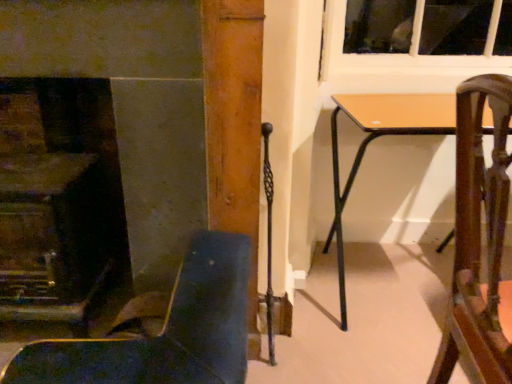
Question: Can you confirm if wooden chair at right, the second chair viewed from the left, is smaller than smooth stone fireplace at left?

Choices:
 (A) no
 (B) yes

Answer: (A)

Question: Is wooden chair at right, placed as the first chair when sorted from right to left, behind smooth stone fireplace at left?

Choices:
 (A) no
 (B) yes

Answer: (A)

Question: Would you say wooden chair at right, the second chair viewed from the left, is outside smooth stone fireplace at left?

Choices:
 (A) no
 (B) yes

Answer: (B)

Question: Is wooden chair at right, the second chair viewed from the left, wider than smooth stone fireplace at left?

Choices:
 (A) no
 (B) yes

Answer: (B)

Question: From a real-world perspective, is wooden chair at right, placed as the first chair when sorted from right to left, on top of smooth stone fireplace at left?

Choices:
 (A) no
 (B) yes

Answer: (A)

Question: Based on their sizes in the image, would you say smooth stone fireplace at left is bigger or smaller than light brown wooden table at center?

Choices:
 (A) small
 (B) big

Answer: (A)

Question: Does point (24, 236) appear closer or farther from the camera than point (430, 112)?

Choices:
 (A) closer
 (B) farther

Answer: (A)

Question: Looking at their shapes, would you say smooth stone fireplace at left is wider or thinner than light brown wooden table at center?

Choices:
 (A) wide
 (B) thin

Answer: (B)

Question: Is smooth stone fireplace at left in front of or behind light brown wooden table at center in the image?

Choices:
 (A) behind
 (B) front

Answer: (B)

Question: From the image's perspective, is leather-like dark blue chair at lower left, placed as the second chair when sorted from right to left, positioned above or below wooden chair at right, placed as the first chair when sorted from right to left?

Choices:
 (A) below
 (B) above

Answer: (A)

Question: In terms of size, does leather-like dark blue chair at lower left, marked as the 1th chair in a left-to-right arrangement, appear bigger or smaller than wooden chair at right, placed as the first chair when sorted from right to left?

Choices:
 (A) big
 (B) small

Answer: (A)

Question: Visually, is leather-like dark blue chair at lower left, placed as the second chair when sorted from right to left, positioned to the left or to the right of wooden chair at right, placed as the first chair when sorted from right to left?

Choices:
 (A) right
 (B) left

Answer: (B)

Question: Considering the positions of leather-like dark blue chair at lower left, placed as the second chair when sorted from right to left, and wooden chair at right, the second chair viewed from the left, in the image, is leather-like dark blue chair at lower left, placed as the second chair when sorted from right to left, taller or shorter than wooden chair at right, the second chair viewed from the left,?

Choices:
 (A) tall
 (B) short

Answer: (B)

Question: From a real-world perspective, is wooden chair at right, the second chair viewed from the left, physically located above or below leather-like dark blue chair at lower left, placed as the second chair when sorted from right to left?

Choices:
 (A) below
 (B) above

Answer: (B)

Question: Is wooden chair at right, the second chair viewed from the left, situated inside leather-like dark blue chair at lower left, placed as the second chair when sorted from right to left, or outside?

Choices:
 (A) outside
 (B) inside

Answer: (A)